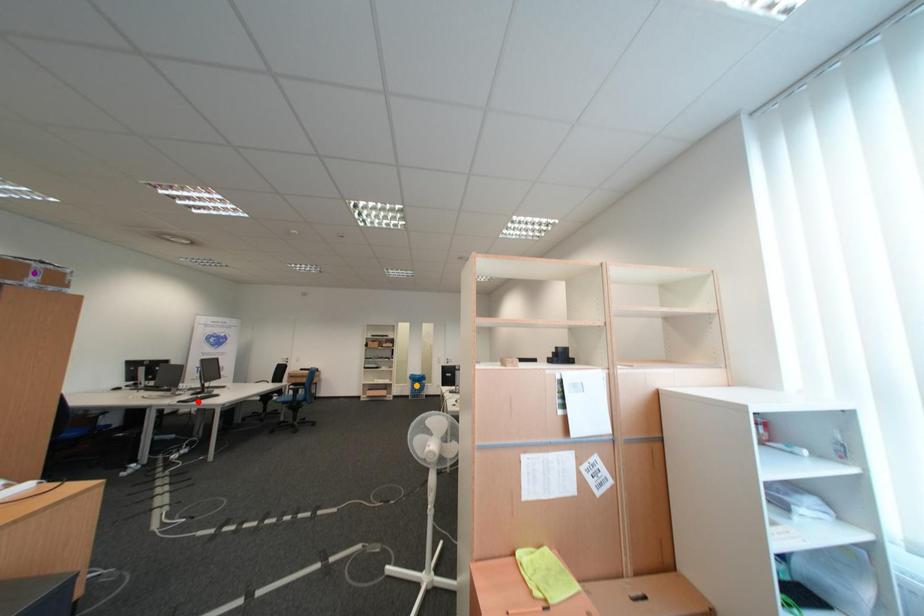
Order these from nearest to farthest:
1. purple point
2. red point
3. orange point

orange point, red point, purple point